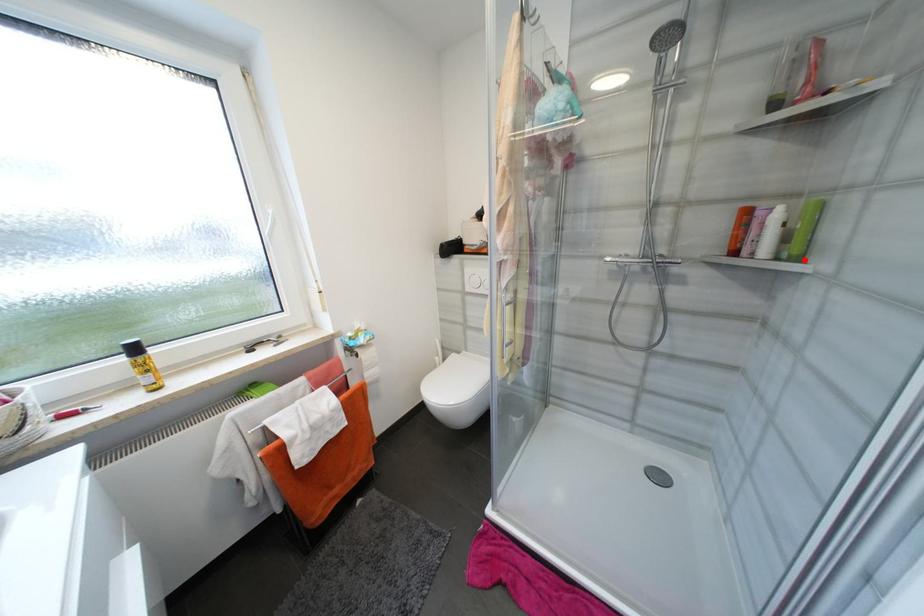
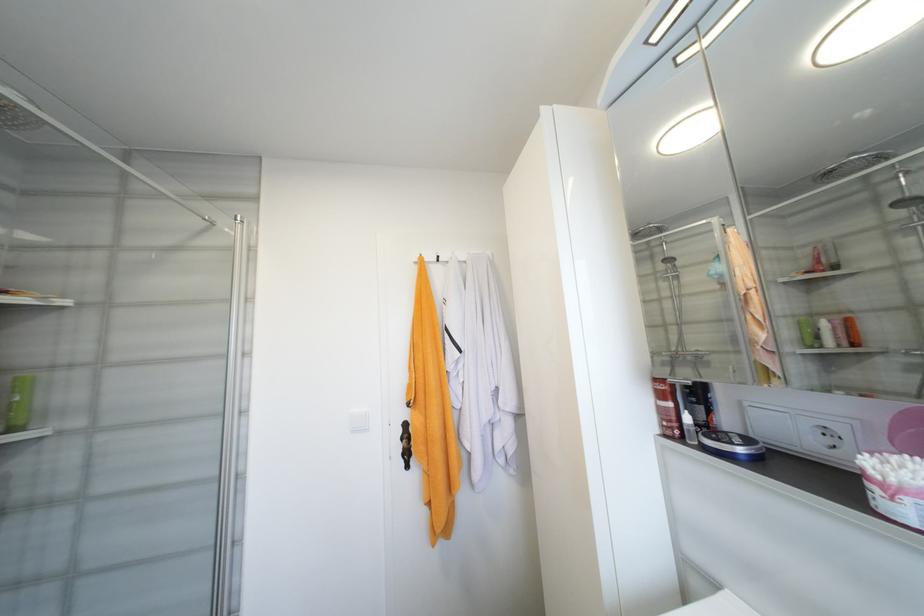
Question: I am providing you with two images of the same scene from different viewpoints. In image1, a red point is highlighted. Considering the same 3D point in image2, which of the following is correct?

Choices:
 (A) It is closer
 (B) It is farther

Answer: (A)